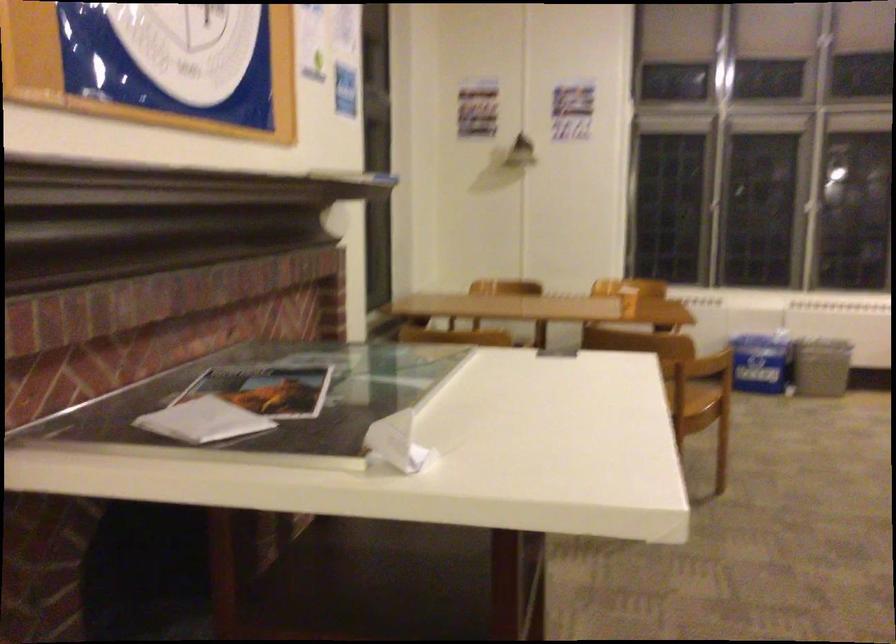
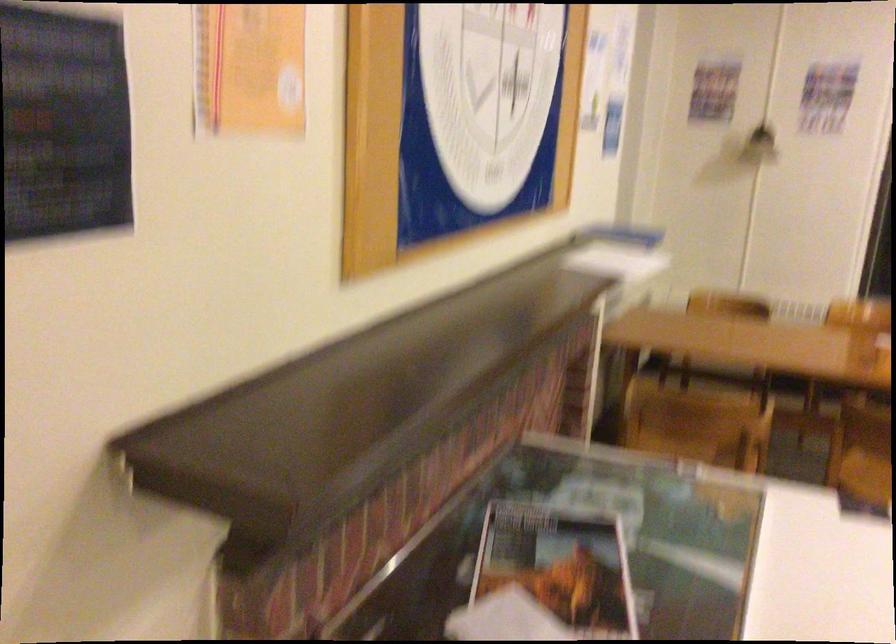
Question: The camera is either moving clockwise (left) or counter-clockwise (right) around the object. The first image is from the beginning of the video and the second image is from the end. Is the camera moving left or right when shooting the video?

Choices:
 (A) Left
 (B) Right

Answer: (B)